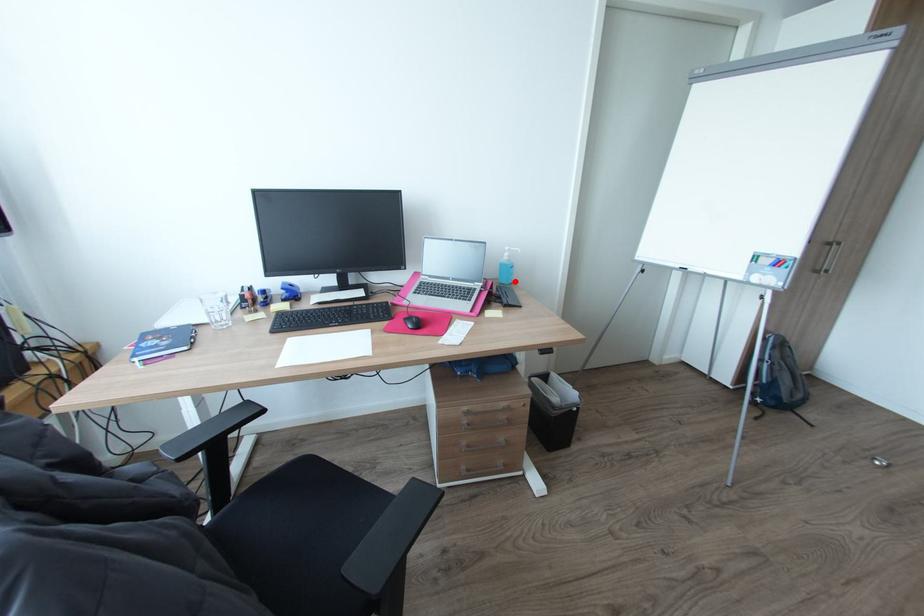
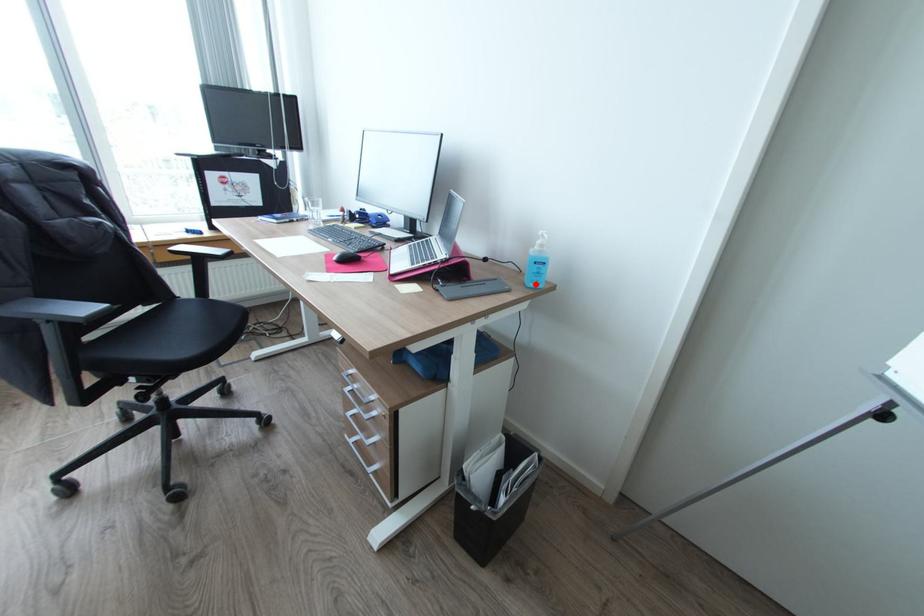
I am providing you with two images of the same scene from different viewpoints. A red point is marked on the first image and another point is marked on the second image. Does the point marked in image1 correspond to the same location as the one in image2?

Yes